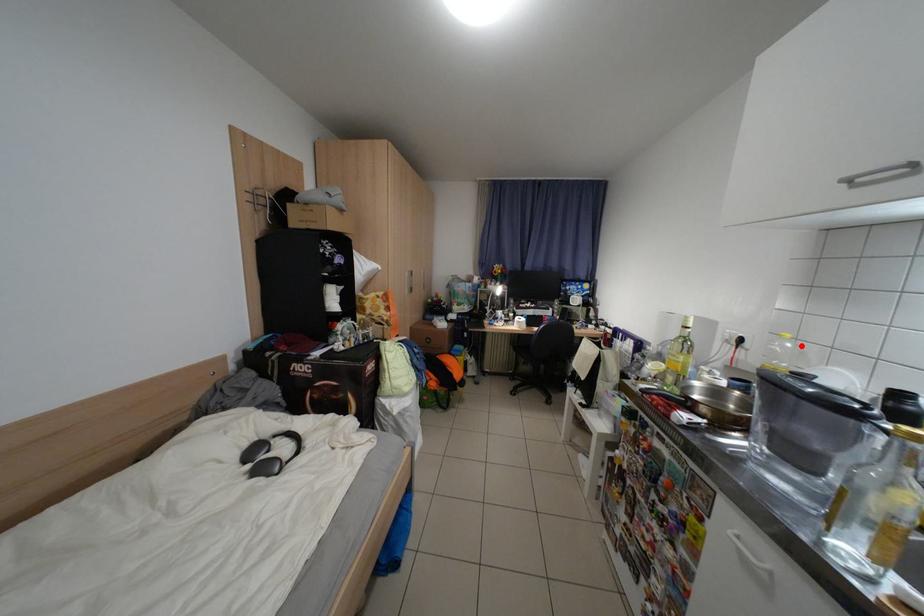
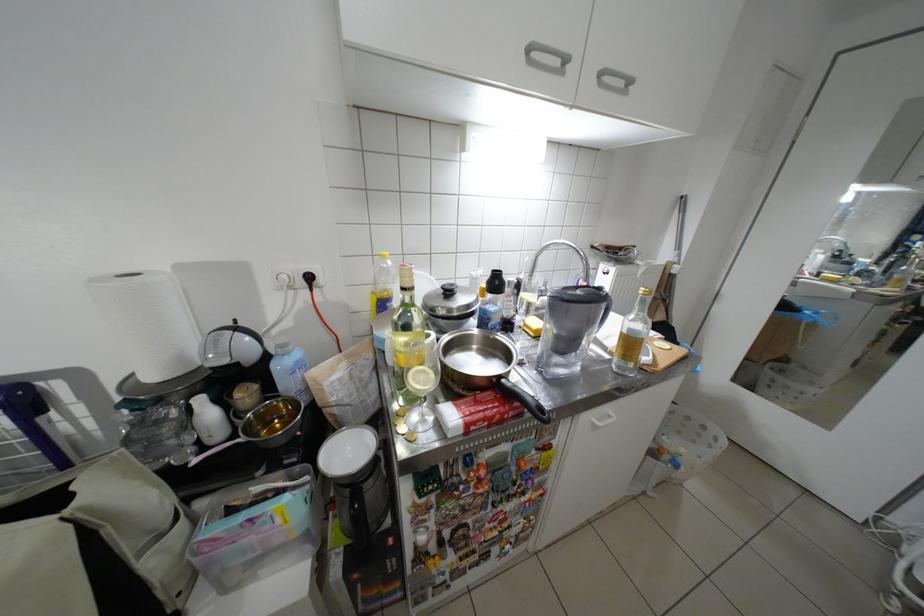
Where in the second image is the point corresponding to the highlighted location from the first image?

(400, 264)